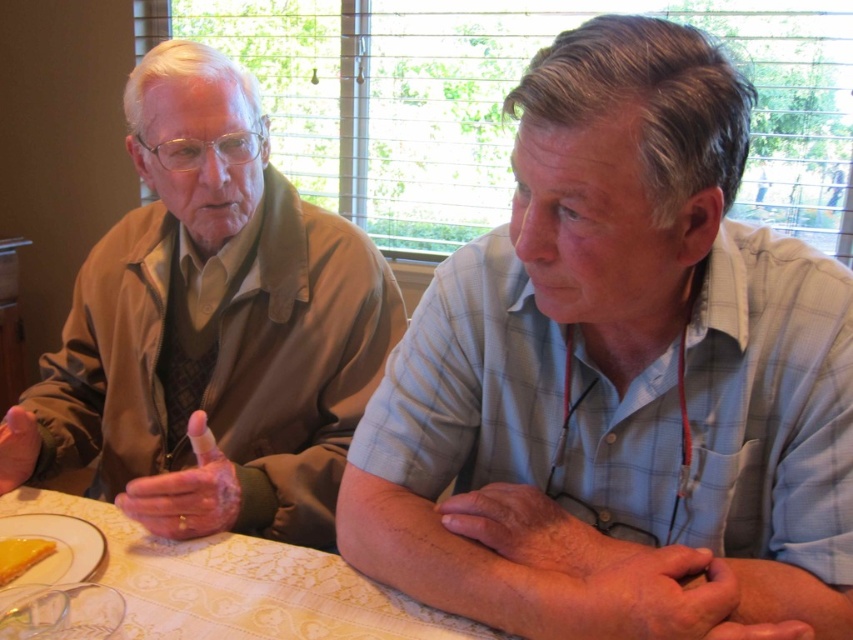
Question: Which point appears farthest from the camera in this image?

Choices:
 (A) (709, 42)
 (B) (15, 540)
 (C) (253, 625)
 (D) (247, 413)

Answer: (D)

Question: Does light blue plaid shirt at center have a larger size compared to matte brown jacket at left?

Choices:
 (A) yes
 (B) no

Answer: (B)

Question: Can you confirm if light blue plaid shirt at center is positioned below white lace tablecloth at center?

Choices:
 (A) no
 (B) yes

Answer: (A)

Question: Which of the following is the closest to the observer?

Choices:
 (A) (515, 419)
 (B) (26, 561)

Answer: (B)

Question: Does white lace tablecloth at center come in front of yellow creamy cake at lower left?

Choices:
 (A) yes
 (B) no

Answer: (A)

Question: Estimate the real-world distances between objects in this image. Which object is closer to the light blue plaid shirt at center?

Choices:
 (A) yellow creamy cake at lower left
 (B) white lace tablecloth at center

Answer: (B)